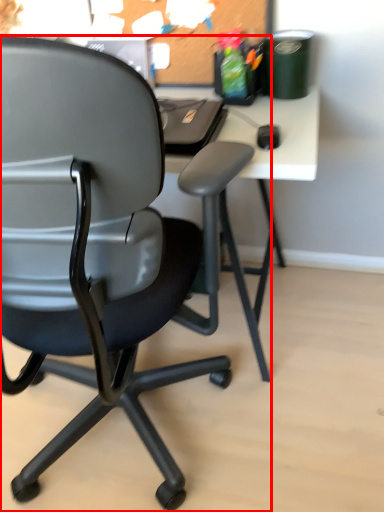
Question: In this image, where is chair (annotated by the red box) located relative to bulletin board?

Choices:
 (A) right
 (B) left

Answer: (B)